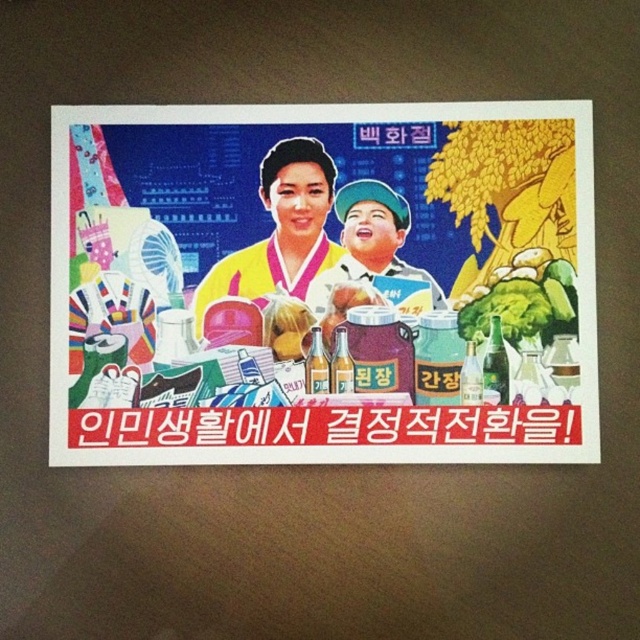
You are an observer looking at the propaganda poster described. The scene includes a yellow silk kimono at center and a matte plastic cup at center. Which object takes up more space in the image?

The yellow silk kimono at center is larger in size than the matte plastic cup at center, so it takes up more space in the image.

You are an observer looking at the propaganda poster. You see a point marked at coordinates (280, 228). Which object from the scene is located exactly at this point?

The point at coordinates (280, 228) indicates the yellow silk kimono at center.

You are an observer looking at the table in the propaganda poster. Which object is closer to you between the matte plastic bottle at center and the yellow silk kimono at center?

The matte plastic bottle at center is in front of the yellow silk kimono at center, so it is closer to you.